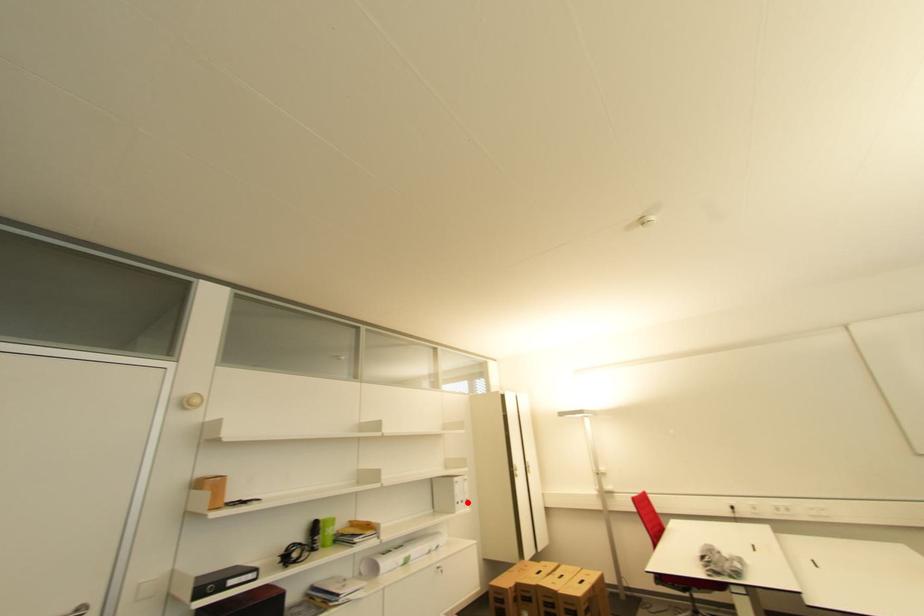
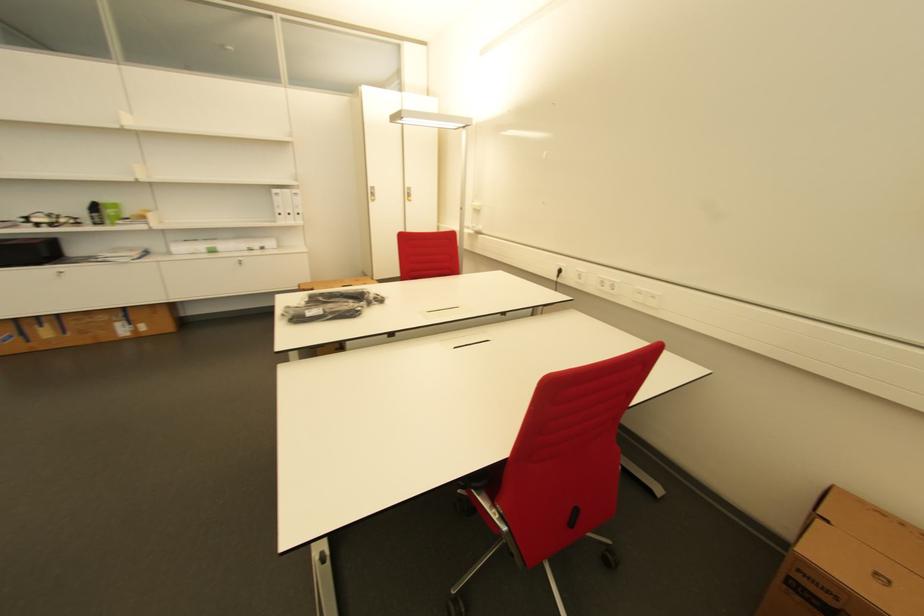
Question: I am providing you with two images of the same scene from different viewpoints. Image1 has a red point marked. In image2, the corresponding 3D location appears at what relative position? Reply with the corresponding letter.

Choices:
 (A) Closer
 (B) Farther

Answer: (A)